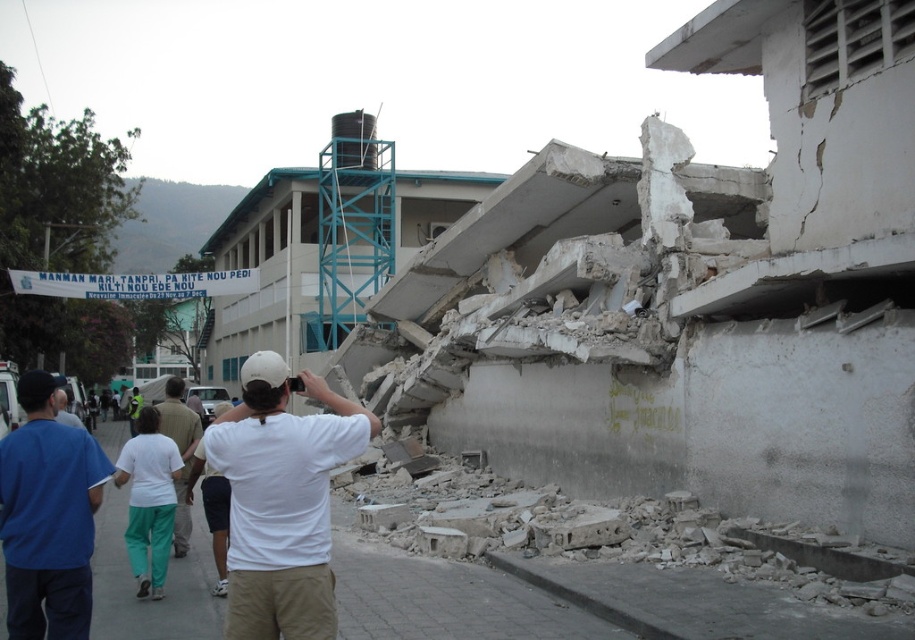
You are a rescue worker trying to locate a blue cotton shirt at left in the disaster area. Based on the coordinates provided, where would you search for it?

The blue cotton shirt at left is located at the coordinates point (48,516) in the scene.

You are a rescue worker in the disaster area and need to locate two white shirts hanging from debris. According to the scene, which shirt is positioned higher up between the white cotton shirt at center and the white matte shirt at center?

The white cotton shirt at center is positioned higher up than the white matte shirt at center.

Consider the image. You are a rescue worker with a 3.5 feet wide stretcher. You need to carry an injured person from the collapsed building to the ambulance parked near the intact building. The path between blue cotton shirt at left and white cotton pants at lower left is the only clear route. Can your stretcher fit through that path?

The distance between blue cotton shirt at left and white cotton pants at lower left is 8.31 feet, which is wider than the stretcher width of 3.5 feet. Therefore, the stretcher can fit through the path between blue cotton shirt at left and white cotton pants at lower left.